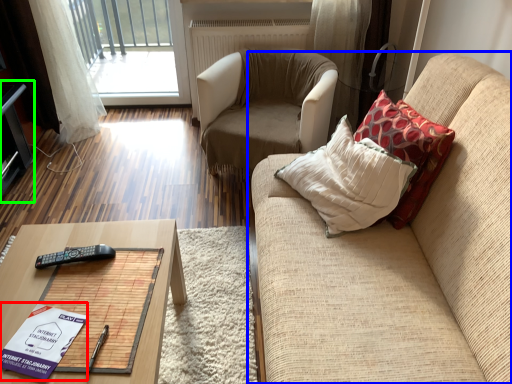
Question: Which is nearer to the book (highlighted by a red box)? studio couch (highlighted by a blue box) or entertainment center (highlighted by a green box).

Choices:
 (A) studio couch
 (B) entertainment center

Answer: (A)